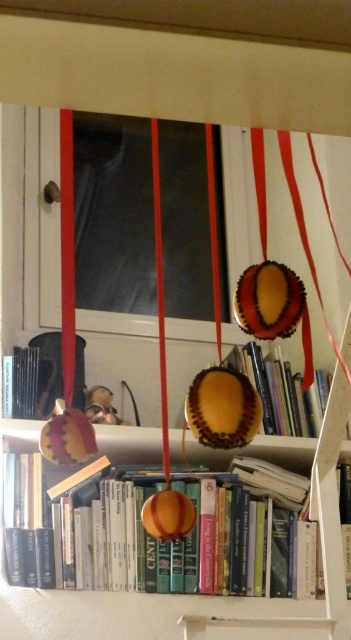
Describe the element at coordinates (154, 538) in the screenshot. The height and width of the screenshot is (640, 351). I see `orange matte/orange matte/orange matte/orange matte/orange matte/orange matte/orange matte/orange matte/orange matte/orange matte/orange matte/orange matte/orange matte/orange matte/orange matte/orange matte/orange matte/orange matte/orange matte/orange matte/orange matte/orange matte/orange matte/orange matte/orange matte/orange matte/orange matte/orange matte/orange matte/orange matte/orange matte/orange matte/orange matte/orange matte/orange matte/orange matte/orange matte/orange matte/orange matte/orange matte/orange matte/orange matte/orange` at that location.

Does orange matte/orange matte/orange matte/orange matte/orange matte/orange matte/orange matte/orange matte/orange matte/orange matte/orange matte/orange matte/orange matte/orange matte/orange matte/orange matte/orange matte/orange matte/orange matte/orange matte/orange matte/orange matte/orange matte/orange matte/orange matte/orange matte/orange matte/orange matte/orange matte/orange matte/orange matte/orange matte/orange matte/orange matte/orange matte/orange matte/orange matte/orange matte/orange matte/orange matte/orange matte/orange matte/orange have a larger size compared to matte orange ornament at center?

Correct, orange matte/orange matte/orange matte/orange matte/orange matte/orange matte/orange matte/orange matte/orange matte/orange matte/orange matte/orange matte/orange matte/orange matte/orange matte/orange matte/orange matte/orange matte/orange matte/orange matte/orange matte/orange matte/orange matte/orange matte/orange matte/orange matte/orange matte/orange matte/orange matte/orange matte/orange matte/orange matte/orange matte/orange matte/orange matte/orange matte/orange matte/orange matte/orange matte/orange matte/orange matte/orange matte/orange is larger in size than matte orange ornament at center.

Is point (303, 589) behind point (310, 404)?

No, (303, 589) is in front of (310, 404).

The width and height of the screenshot is (351, 640). I want to click on orange matte/orange matte/orange matte/orange matte/orange matte/orange matte/orange matte/orange matte/orange matte/orange matte/orange matte/orange matte/orange matte/orange matte/orange matte/orange matte/orange matte/orange matte/orange matte/orange matte/orange matte/orange matte/orange matte/orange matte/orange matte/orange matte/orange matte/orange matte/orange matte/orange matte/orange matte/orange matte/orange matte/orange matte/orange matte/orange matte/orange matte/orange matte/orange matte/orange matte/orange matte/orange matte/orange, so click(x=154, y=538).